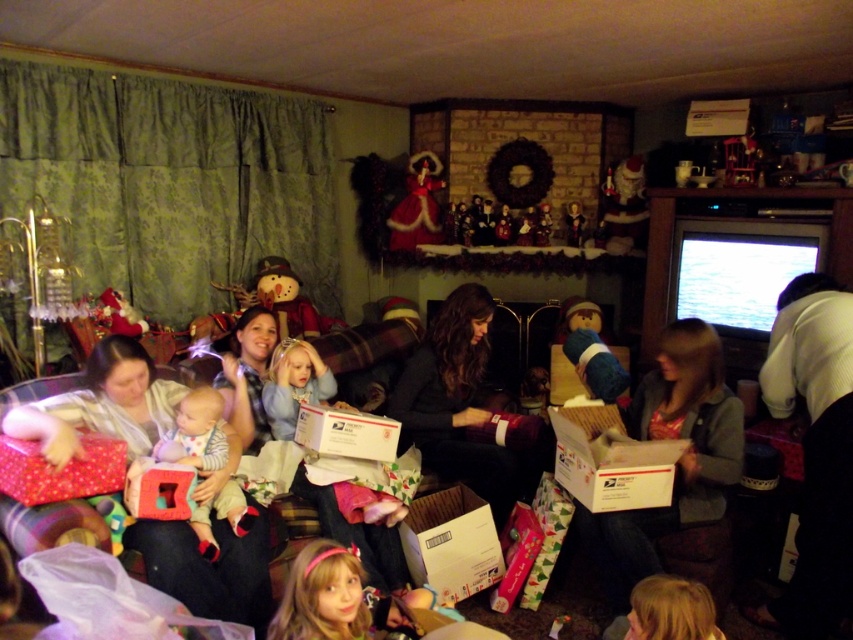
You are organizing a gift wrapping station in the living room. You have a dark gray sweater at center and a wooden nutcracker at center. Which object should you place on the narrower side of the gift wrapping table to ensure both items fit comfortably?

The wooden nutcracker at center should be placed on the narrower side of the gift wrapping table since the dark gray sweater at center might be wider, allowing both items to fit comfortably.

Looking at this image, you are a guest at this festive gathering and want to place a small gift on the mantelpiece. The dark gray sweater at center and the wooden nutcracker at center are both on the mantelpiece. Which object is closer to the bottom edge of the mantelpiece?

The dark gray sweater at center is positioned under the wooden nutcracker at center, so the dark gray sweater at center is closer to the bottom edge of the mantelpiece.

You are a child who wants to place both the blue plush bear at center and the velvet red doll at upper center into a narrow gift box. Which toy can fit better into the box if the box is designed to accommodate thinner items?

The blue plush bear at center is thinner than the velvet red doll at upper center, so it can fit better into the narrow gift box.